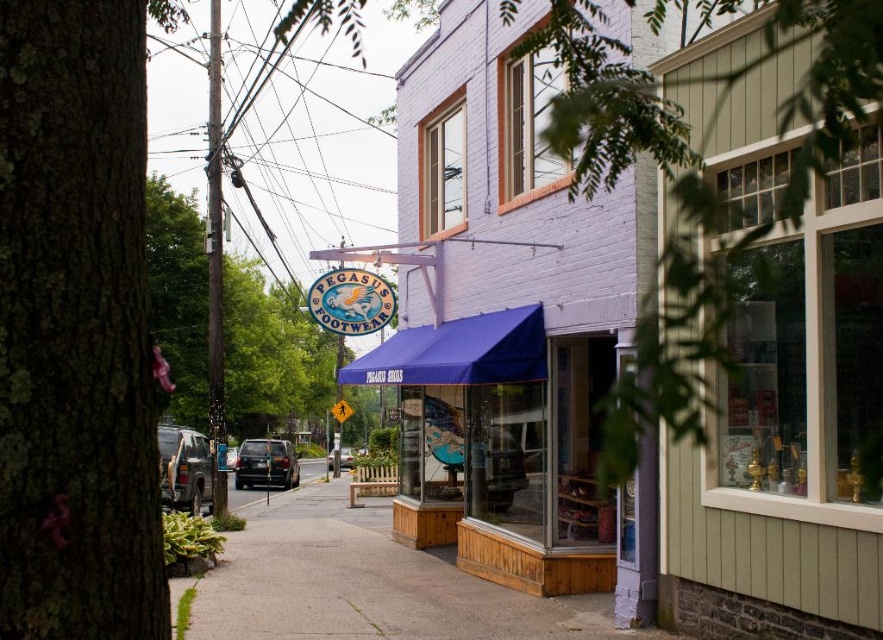
You are standing on the street looking at the Pegasus Footwear store. There are two points marked on the buildings to your right. Which of these two points, point 1 at coordinates (x=255, y=493) or point 2 at (x=338, y=465), is closer to you?

Point 1 at coordinates (x=255, y=493) is closer to the viewer than point 2 at (x=338, y=465).

You are standing on the smooth concrete sidewalk at center and want to get to the matte black suv at center. Which direction should you move to reach it?

The smooth concrete sidewalk at center is located above the matte black suv at center, so you should move downward to reach the matte black suv at center.

You are a delivery person trying to locate the Pegasus Footwear store. You see the purple brick building at center and the matte green window at center. Which one is closer to the left side of the street?

The purple brick building at center is positioned on the left side of matte green window at center, so it is closer to the left side of the street.